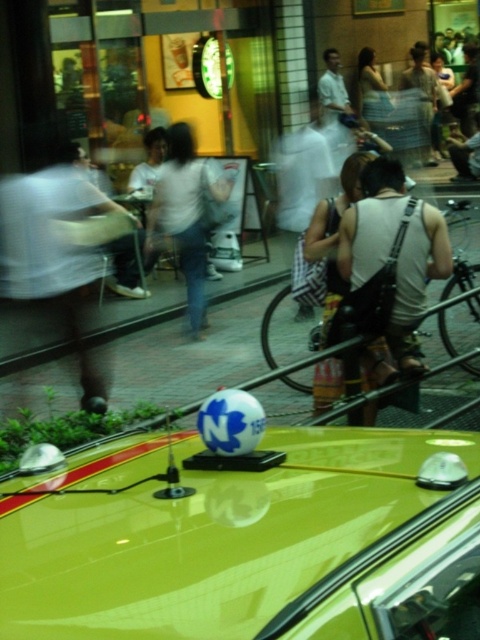
You are a photographer trying to capture a clear image of the shiny yellow car at center and the white cotton shirt at center. Which object should you focus on first if you want to ensure both are in focus, considering their sizes in the frame?

The shiny yellow car at center is smaller than the white cotton shirt at center, so you should focus on the smaller object first to ensure depth of field covers both.